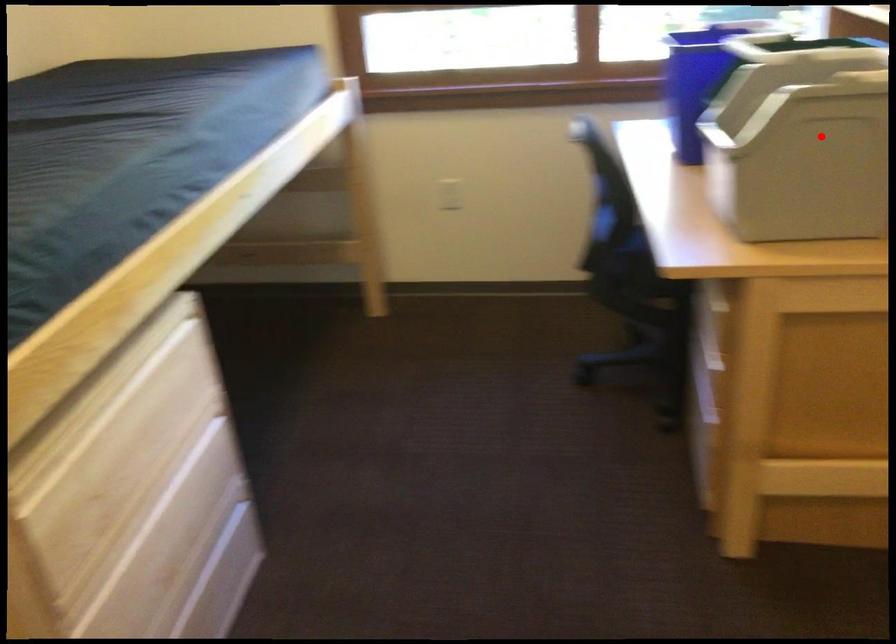
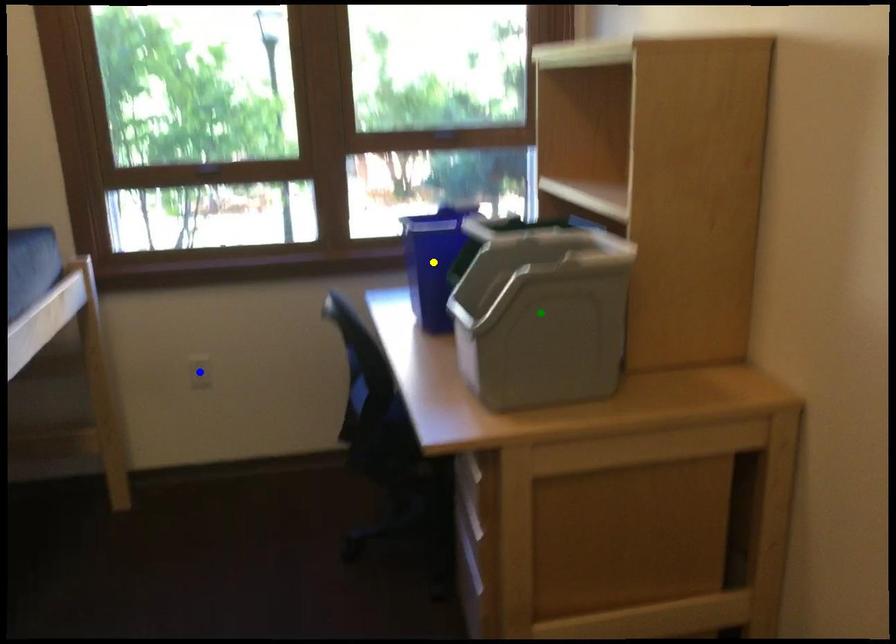
Question: I am providing you with two images of the same scene from different viewpoints. A red point is marked on the first image. You are given multiple points on the second image. Which spot in image 2 lines up with the point in image 1?

Choices:
 (A) green point
 (B) yellow point
 (C) blue point

Answer: (A)